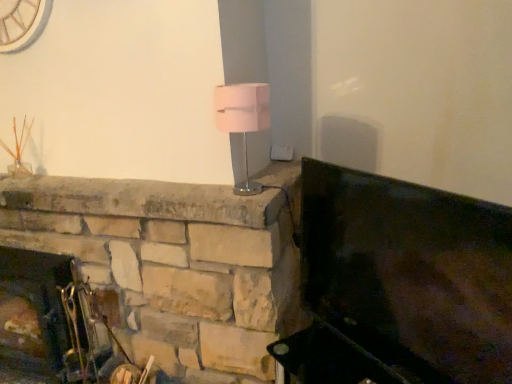
Question: Should I look upward or downward to see metallic silver fireplace tools at lower left?

Choices:
 (A) down
 (B) up

Answer: (A)

Question: Is pink fabric lampshade at center further to the viewer compared to metallic silver fireplace tools at lower left?

Choices:
 (A) yes
 (B) no

Answer: (B)

Question: Is pink fabric lampshade at center wider than metallic silver fireplace tools at lower left?

Choices:
 (A) yes
 (B) no

Answer: (B)

Question: From the image's perspective, is pink fabric lampshade at center on top of metallic silver fireplace tools at lower left?

Choices:
 (A) no
 (B) yes

Answer: (B)

Question: Is pink fabric lampshade at center at the right side of metallic silver fireplace tools at lower left?

Choices:
 (A) no
 (B) yes

Answer: (B)

Question: Is pink fabric lampshade at center facing away from metallic silver fireplace tools at lower left?

Choices:
 (A) yes
 (B) no

Answer: (B)

Question: Is pink fabric lampshade at center thinner than metallic silver fireplace tools at lower left?

Choices:
 (A) no
 (B) yes

Answer: (B)

Question: From the image's perspective, would you say metallic dark green fireplace at right is positioned over metallic silver fireplace tools at lower left?

Choices:
 (A) no
 (B) yes

Answer: (B)

Question: Is metallic dark green fireplace at right closer to the viewer compared to metallic silver fireplace tools at lower left?

Choices:
 (A) yes
 (B) no

Answer: (A)

Question: Does metallic dark green fireplace at right have a greater height compared to metallic silver fireplace tools at lower left?

Choices:
 (A) yes
 (B) no

Answer: (B)

Question: From a real-world perspective, is metallic dark green fireplace at right located higher than metallic silver fireplace tools at lower left?

Choices:
 (A) no
 (B) yes

Answer: (B)

Question: Does metallic dark green fireplace at right have a lesser height compared to metallic silver fireplace tools at lower left?

Choices:
 (A) yes
 (B) no

Answer: (A)

Question: Is metallic dark green fireplace at right positioned beyond the bounds of metallic silver fireplace tools at lower left?

Choices:
 (A) no
 (B) yes

Answer: (B)

Question: Does pink fabric lampshade at center come in front of metallic dark green fireplace at right?

Choices:
 (A) yes
 (B) no

Answer: (B)